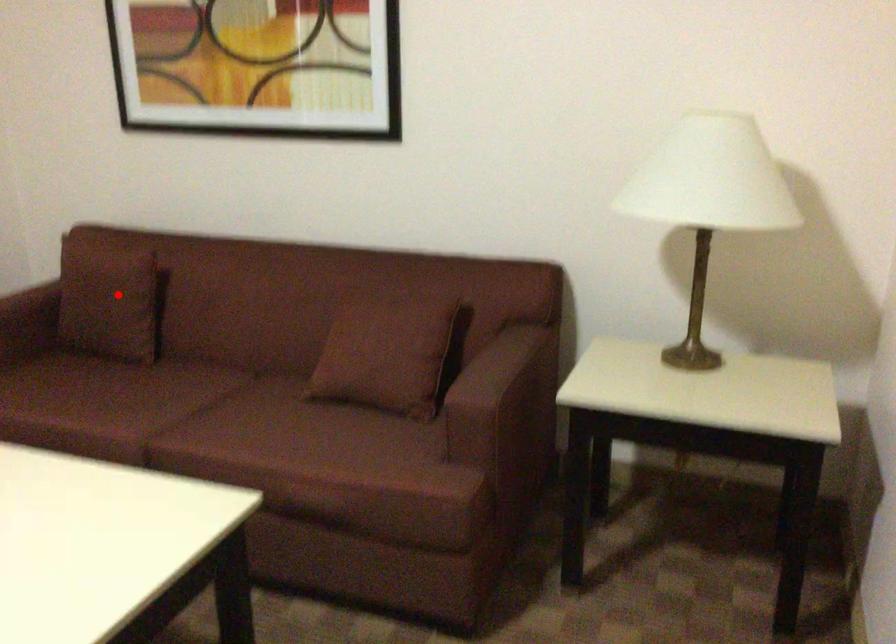
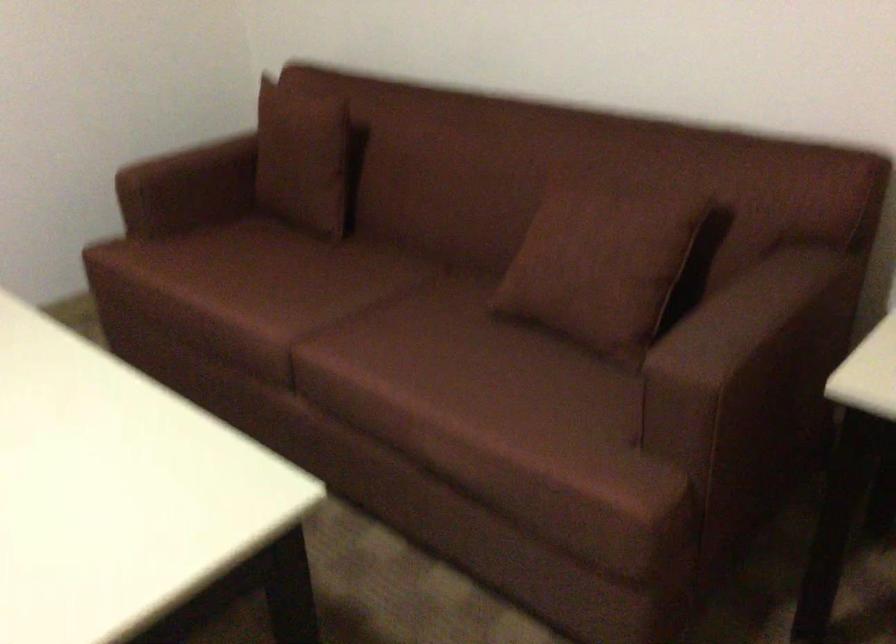
Question: I am providing you with two images of the same scene from different viewpoints. A red point is shown in image1. For the corresponding object point in image2, is it positioned nearer or farther from the camera?

Choices:
 (A) Nearer
 (B) Farther

Answer: (A)